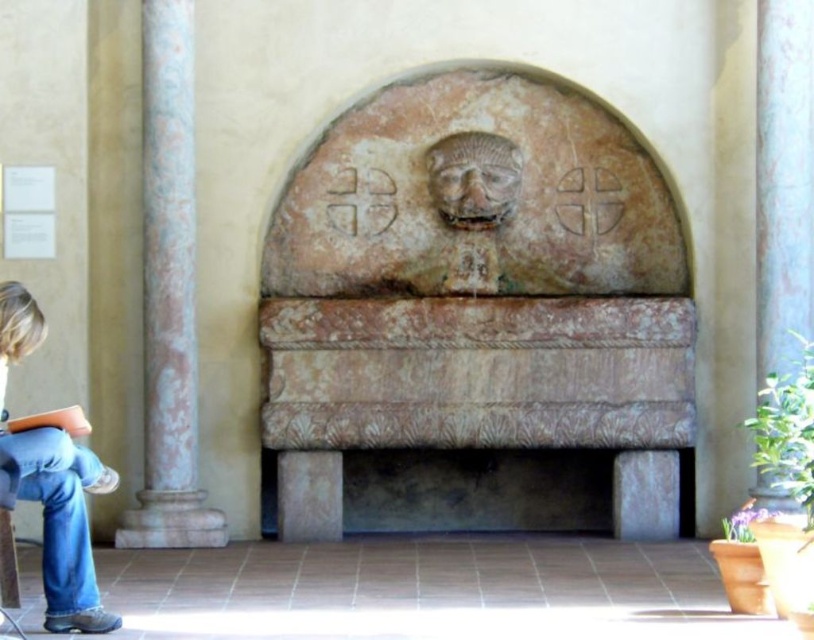
Question: Which of the following is the closest to the observer?

Choices:
 (A) marble column at right
 (B) blue jeans at lower left
 (C) rustic stone fountain at center

Answer: (B)

Question: Can you confirm if marble column at right is positioned above blue jeans at lower left?

Choices:
 (A) yes
 (B) no

Answer: (A)

Question: Which object appears closest to the camera in this image?

Choices:
 (A) blue jeans at lower left
 (B) rustic stone fountain at center

Answer: (A)

Question: Which object is the closest to the rustic stone fountain at center?

Choices:
 (A) marble column at right
 (B) blue jeans at lower left
 (C) marble column at left

Answer: (A)

Question: Does rustic stone fountain at center have a larger size compared to marble column at right?

Choices:
 (A) yes
 (B) no

Answer: (A)

Question: Can you confirm if marble column at left is positioned to the left of marble column at right?

Choices:
 (A) no
 (B) yes

Answer: (B)